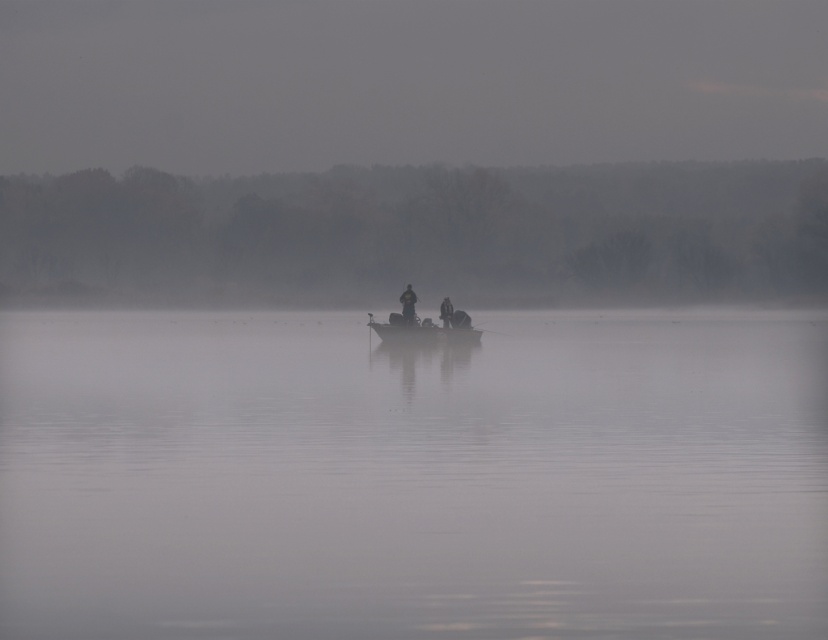
Question: Observing the image, what is the correct spatial positioning of dark blue jacket at center in reference to dark gray jacket at center?

Choices:
 (A) right
 (B) left

Answer: (B)

Question: Which point appears closest to the camera in this image?

Choices:
 (A) (446, 324)
 (B) (629, 618)

Answer: (B)

Question: Is foggy misty atmosphere at center bigger than metallic gray boat at center?

Choices:
 (A) yes
 (B) no

Answer: (A)

Question: Is dark blue jacket at center smaller than dark gray jacket at center?

Choices:
 (A) yes
 (B) no

Answer: (B)

Question: Which object appears closest to the camera in this image?

Choices:
 (A) metallic gray boat at center
 (B) foggy misty atmosphere at center
 (C) dark blue jacket at center

Answer: (C)

Question: Among these objects, which one is farthest from the camera?

Choices:
 (A) dark blue jacket at center
 (B) foggy misty atmosphere at center
 (C) metallic gray boat at center

Answer: (C)